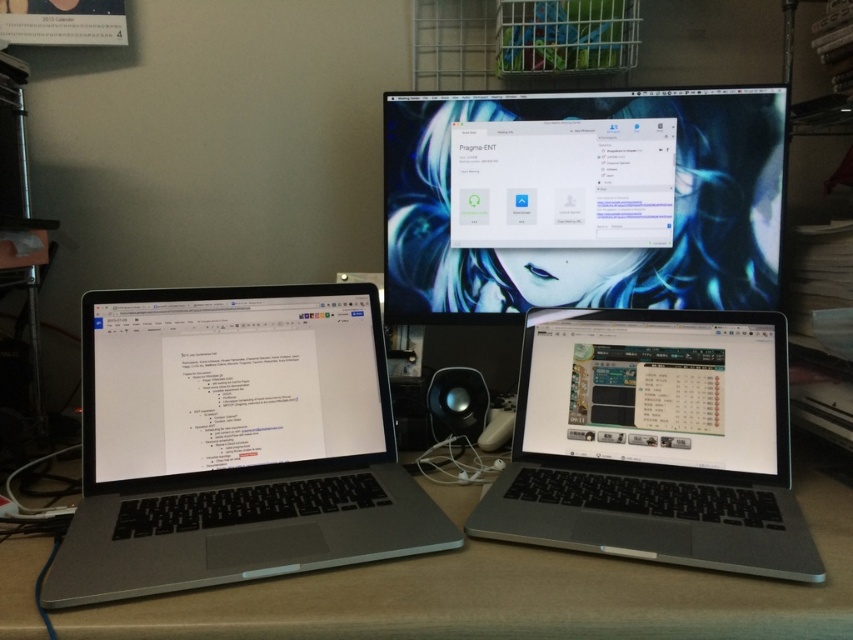
Who is shorter, slate gray laptop at left or satin silver laptop at lower center?

satin silver laptop at lower center

Is slate gray laptop at left smaller than satin silver laptop at lower center?

Correct, slate gray laptop at left occupies less space than satin silver laptop at lower center.

Where is `slate gray laptop at left`? This screenshot has width=853, height=640. slate gray laptop at left is located at coordinates (235, 442).

Does slate gray laptop at left have a greater height compared to matte black laptop at lower right?

Indeed, slate gray laptop at left has a greater height compared to matte black laptop at lower right.

Describe the element at coordinates (235, 442) in the screenshot. The image size is (853, 640). I see `slate gray laptop at left` at that location.

This screenshot has width=853, height=640. I want to click on slate gray laptop at left, so click(235, 442).

Identify the location of slate gray laptop at left. (235, 442).

Does matte black laptop at lower right have a lesser width compared to black matte speaker at center?

Incorrect, matte black laptop at lower right's width is not less than black matte speaker at center's.

The height and width of the screenshot is (640, 853). Find the location of `matte black laptop at lower right`. matte black laptop at lower right is located at coordinates (656, 388).

The image size is (853, 640). I want to click on matte black laptop at lower right, so click(656, 388).